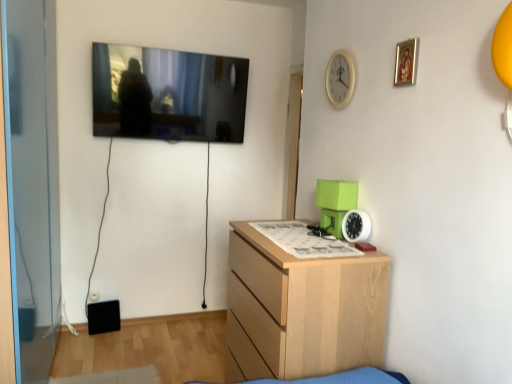
Question: In the image, is gold-framed picture at upper right positioned in front of or behind white plastic clock at right, arranged as the 2th clock when viewed from the top?

Choices:
 (A) behind
 (B) front

Answer: (B)

Question: From a real-world perspective, is gold-framed picture at upper right positioned above or below white plastic clock at right, arranged as the 2th clock when viewed from the top?

Choices:
 (A) above
 (B) below

Answer: (A)

Question: Which of these objects is positioned closest to the white plastic clock at right, arranged as the 2th clock when viewed from the top?

Choices:
 (A) white wooden clock at upper center, the 1th clock from the top
 (B) light wood chest of drawers at lower right
 (C) gold-framed picture at upper right
 (D) flat screen tv at upper left

Answer: (B)

Question: Which is nearer to the white wooden clock at upper center, the 1th clock from the top?

Choices:
 (A) flat screen tv at upper left
 (B) white plastic clock at right, arranged as the 2th clock when viewed from the top
 (C) gold-framed picture at upper right
 (D) light wood chest of drawers at lower right

Answer: (C)